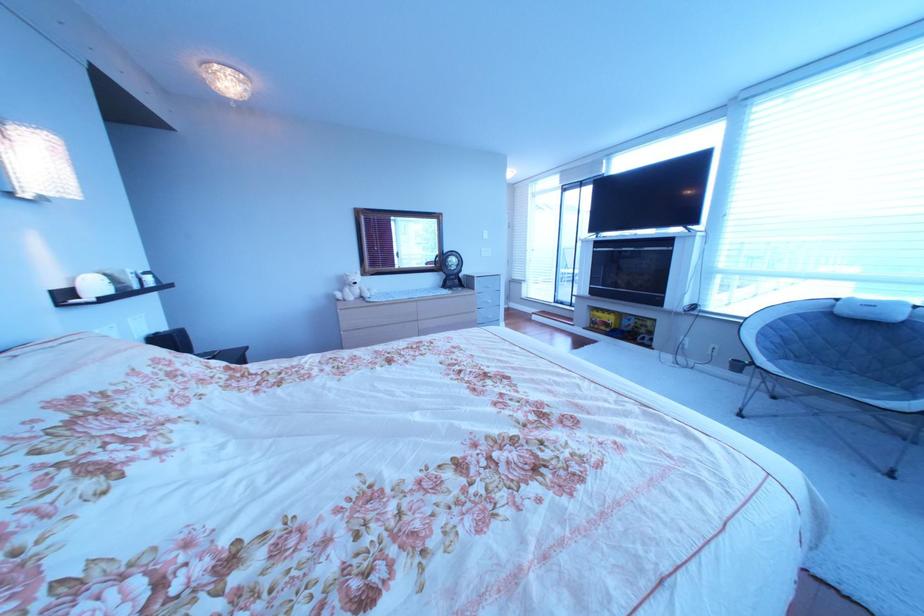
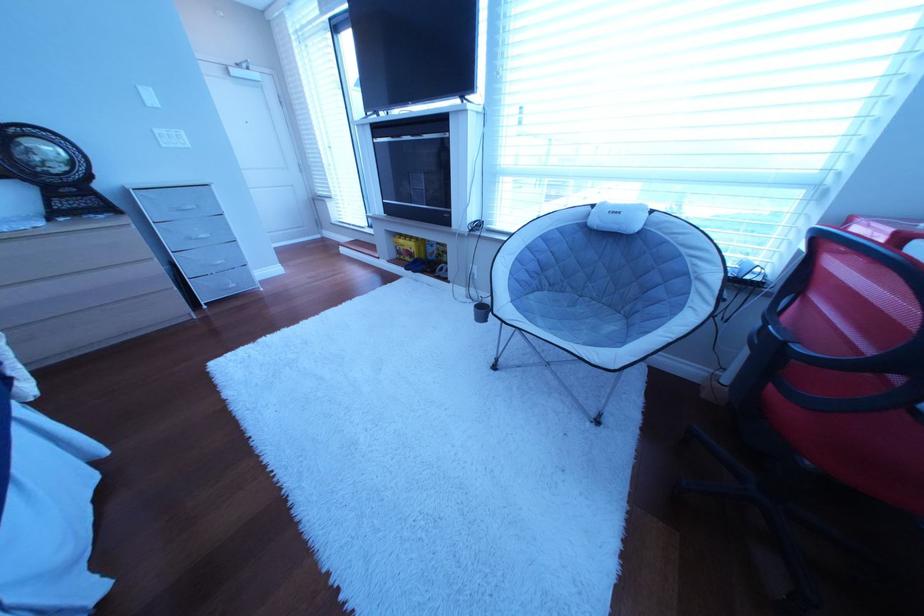
In the second image, find the point that corresponds to point 810,363 in the first image.

(565, 293)